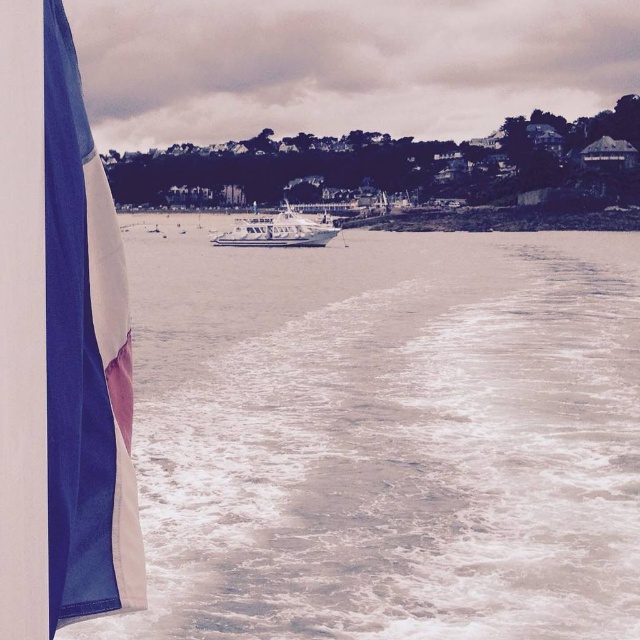
Consider the image. Does white frothy water at lower center come behind white matte boat at center?

That is False.

Between white frothy water at lower center and white matte boat at center, which one appears on the left side from the viewer's perspective?

Positioned to the left is white matte boat at center.

This screenshot has height=640, width=640. Describe the element at coordinates (387, 440) in the screenshot. I see `white frothy water at lower center` at that location.

This screenshot has height=640, width=640. Find the location of `white frothy water at lower center`. white frothy water at lower center is located at coordinates pos(387,440).

Is blue fabric flag at left further to camera compared to white matte boat at center?

No, it is in front of white matte boat at center.

Between point (104, 497) and point (300, 221), which one is positioned in front?

Point (104, 497) is in front.

The height and width of the screenshot is (640, 640). I want to click on blue fabric flag at left, so click(84, 360).

Does white frothy water at lower center lie in front of blue fabric flag at left?

No, it is not.

Is white frothy water at lower center behind blue fabric flag at left?

Yes, it is behind blue fabric flag at left.

Locate an element on the screen. white frothy water at lower center is located at coordinates (387, 440).

Identify the location of white frothy water at lower center. (387, 440).